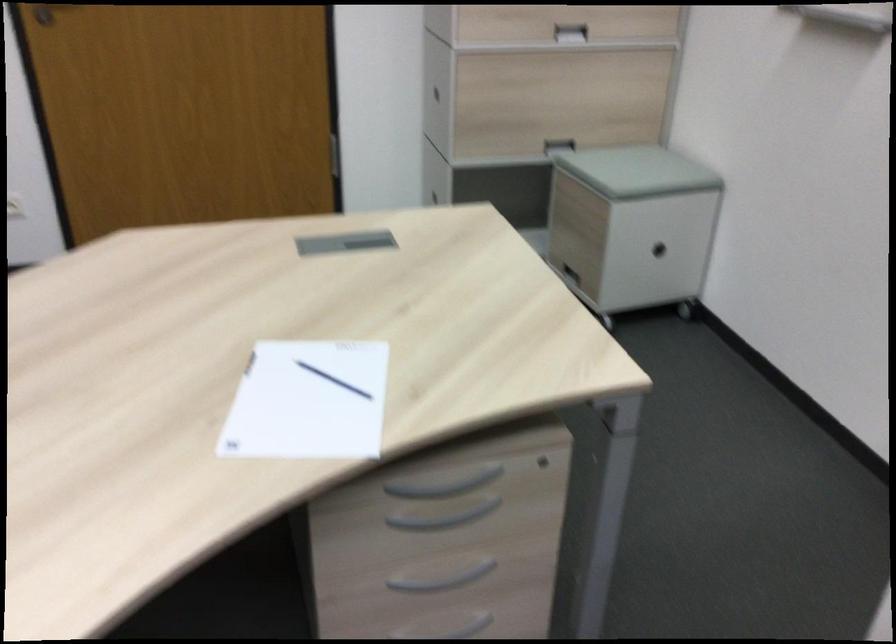
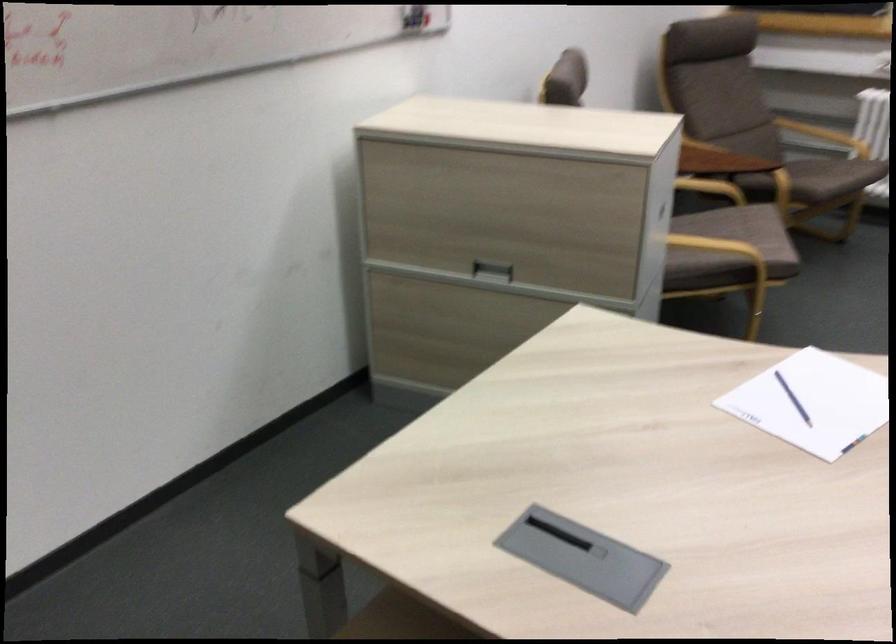
Question: I am providing you with two images of the same scene from different viewpoints. After the viewpoint changes to image2, which objects are now occluded?

Choices:
 (A) chair sitting surface
 (B) white lip balm
 (C) grey drawer handle
 (D) cabinet drawer handle

Answer: (C)